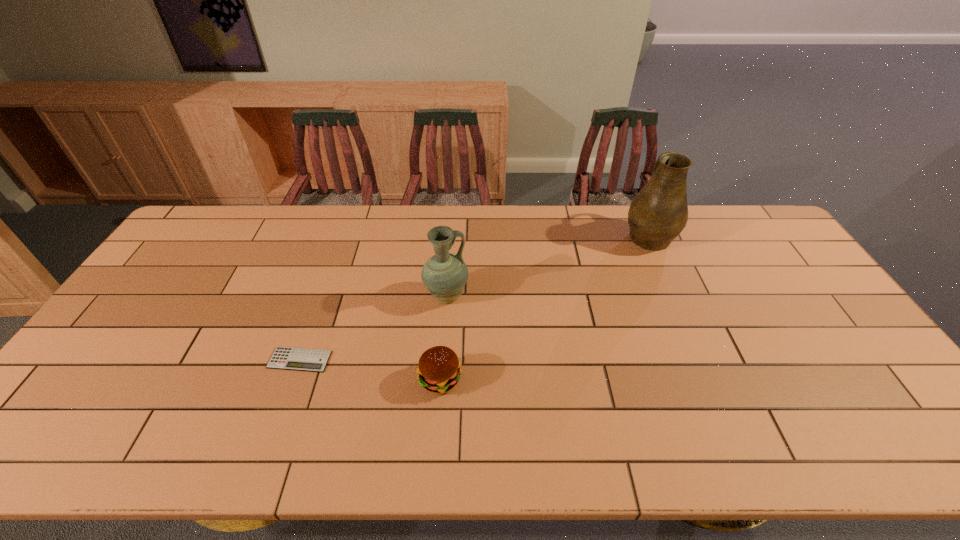
At what (x,y) coordinates should I click in order to perform the action: click on vacant space that's between the hamburger and the second tallest object. Please return your answer as a coordinate pair (x, y). The image size is (960, 540). Looking at the image, I should click on (444, 338).

You are a GUI agent. You are given a task and a screenshot of the screen. Output one action in this format:
    pyautogui.click(x=<x>, y=<y>)
    Task: Click on the free space between the leftmost object and the shorter pitcher
    This screenshot has height=540, width=960.
    Given the screenshot: What is the action you would take?
    pyautogui.click(x=373, y=328)

You are a GUI agent. You are given a task and a screenshot of the screen. Output one action in this format:
    pyautogui.click(x=<x>, y=<y>)
    Task: Click on the free space between the leftmost object and the rightmost object
    Image resolution: width=960 pixels, height=540 pixels.
    Given the screenshot: What is the action you would take?
    pyautogui.click(x=474, y=298)

The width and height of the screenshot is (960, 540). Identify the location of free spot between the rightmost object and the shortest object. (474, 298).

The width and height of the screenshot is (960, 540). I want to click on unoccupied position between the third tallest object and the shortest object, so click(370, 370).

Locate which object ranks third in proximity to the leftmost object. Please provide its 2D coordinates. Your answer should be formatted as a tuple, i.e. [(x, y)], where the tuple contains the x and y coordinates of a point satisfying the conditions above.

[(659, 212)]

This screenshot has height=540, width=960. Identify the location of object that stands as the second closest to the leftmost object. (445, 274).

This screenshot has height=540, width=960. I want to click on vacant point that satisfies the following two spatial constraints: 1. on the handle side of the shorter pitcher; 2. on the front side of the second shortest object, so click(441, 380).